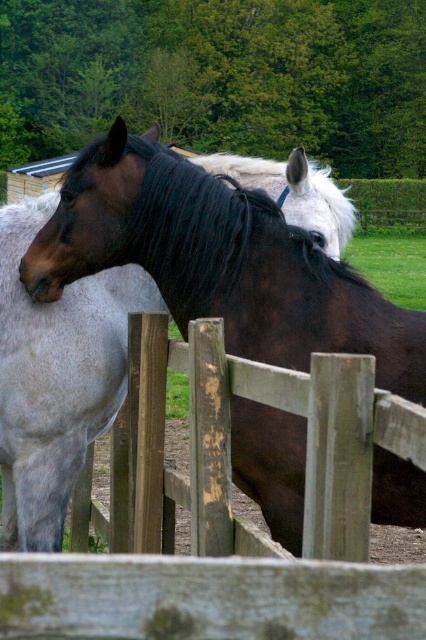
Can you confirm if shiny brown horse at left is shorter than shiny brown horse at center?

In fact, shiny brown horse at left may be taller than shiny brown horse at center.

Does shiny brown horse at left appear over shiny brown horse at center?

Indeed, shiny brown horse at left is positioned over shiny brown horse at center.

Does point (94, 268) come in front of point (48, 420)?

Yes, point (94, 268) is closer to viewer.

Where is `shiny brown horse at left`? Image resolution: width=426 pixels, height=640 pixels. shiny brown horse at left is located at coordinates [x=218, y=260].

Can you confirm if weathered wood fence at center is wider than shiny brown horse at center?

No, weathered wood fence at center is not wider than shiny brown horse at center.

In the scene shown: Does weathered wood fence at center appear under shiny brown horse at center?

No.

Find the location of `weathered wood fence at center`. weathered wood fence at center is located at coordinates (230, 516).

You are a GUI agent. You are given a task and a screenshot of the screen. Output one action in this format:
    pyautogui.click(x=<x>, y=<y>)
    Task: Click on the weathered wood fence at center
    
    Given the screenshot: What is the action you would take?
    pyautogui.click(x=230, y=516)

Which of these two, weathered wood fence at center or shiny brown horse at left, stands taller?

shiny brown horse at left is taller.

Is weathered wood fence at center further to the viewer compared to shiny brown horse at left?

No, weathered wood fence at center is in front of shiny brown horse at left.

Is point (399, 401) farther from camera compared to point (161, 284)?

No, (399, 401) is closer to viewer.

I want to click on weathered wood fence at center, so click(230, 516).